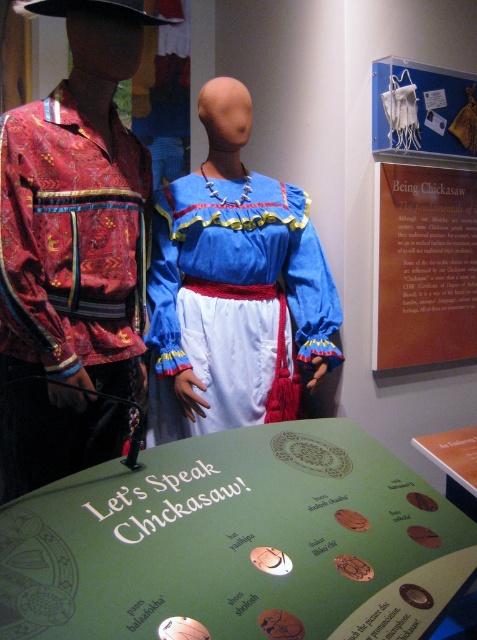
Question: Can you confirm if matte red fabric shirt at left is positioned to the left of matte blue fabric dress at center?

Choices:
 (A) yes
 (B) no

Answer: (A)

Question: Is matte red fabric shirt at left thinner than brown paper sign at upper center?

Choices:
 (A) yes
 (B) no

Answer: (A)

Question: Which point appears closest to the camera in this image?

Choices:
 (A) (308, 259)
 (B) (52, 140)
 (C) (197, 456)
 (D) (391, 268)

Answer: (C)

Question: Which object appears farthest from the camera in this image?

Choices:
 (A) green cardboard sign at center
 (B) brown paper sign at upper center
 (C) matte blue fabric dress at center
 (D) matte red fabric shirt at left

Answer: (B)

Question: Does matte blue fabric dress at center have a greater width compared to brown paper sign at upper center?

Choices:
 (A) no
 (B) yes

Answer: (B)

Question: Estimate the real-world distances between objects in this image. Which object is closer to the brown paper sign at upper center?

Choices:
 (A) matte blue fabric dress at center
 (B) green cardboard sign at center
 (C) matte red fabric shirt at left

Answer: (A)